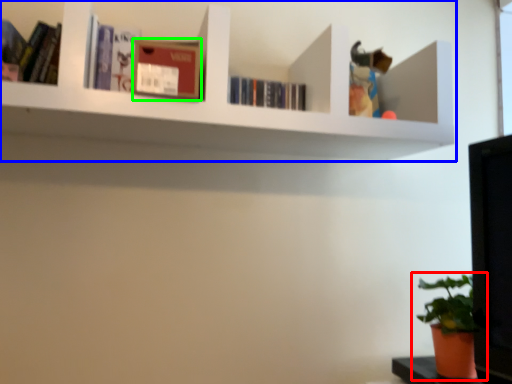
Question: Which object is positioned closest to houseplant (highlighted by a red box)? Select from shelf (highlighted by a blue box) and paperback book (highlighted by a green box).

Choices:
 (A) shelf
 (B) paperback book

Answer: (A)